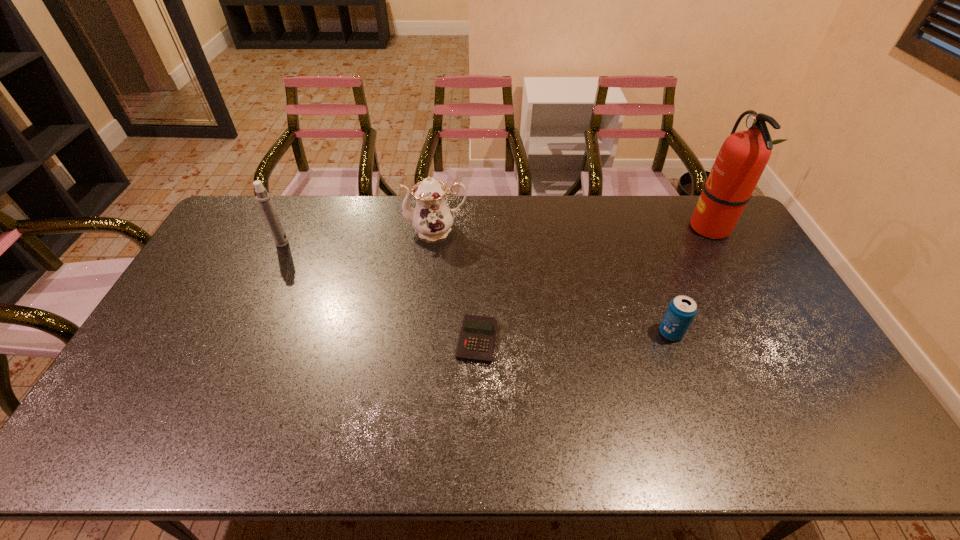
The width and height of the screenshot is (960, 540). In order to click on the rightmost object in this screenshot , I will do `click(744, 155)`.

In order to click on the tallest object in this screenshot , I will do `click(744, 155)`.

Locate an element on the screen. Image resolution: width=960 pixels, height=540 pixels. the leftmost object is located at coordinates (263, 198).

At what (x,y) coordinates should I click in order to perform the action: click on chinaware. Please return your answer as a coordinate pair (x, y). Image resolution: width=960 pixels, height=540 pixels. Looking at the image, I should click on (432, 218).

Locate an element on the screen. the fourth object from left to right is located at coordinates (681, 311).

Locate an element on the screen. Image resolution: width=960 pixels, height=540 pixels. soda can is located at coordinates (681, 311).

The image size is (960, 540). Find the location of `calculator`. calculator is located at coordinates (476, 343).

Image resolution: width=960 pixels, height=540 pixels. In order to click on free spot located on the side of the fire extinguisher with the nozzle and handle in this screenshot , I will do `click(642, 227)`.

At what (x,y) coordinates should I click in order to perform the action: click on vacant space situated 0.250m on the side of the fire extinguisher with the nozzle and handle. Please return your answer as a coordinate pair (x, y). This screenshot has height=540, width=960. Looking at the image, I should click on (621, 227).

Identify the location of vacant space located 0.100m on the side of the fire extinguisher with the nozzle and handle. (661, 227).